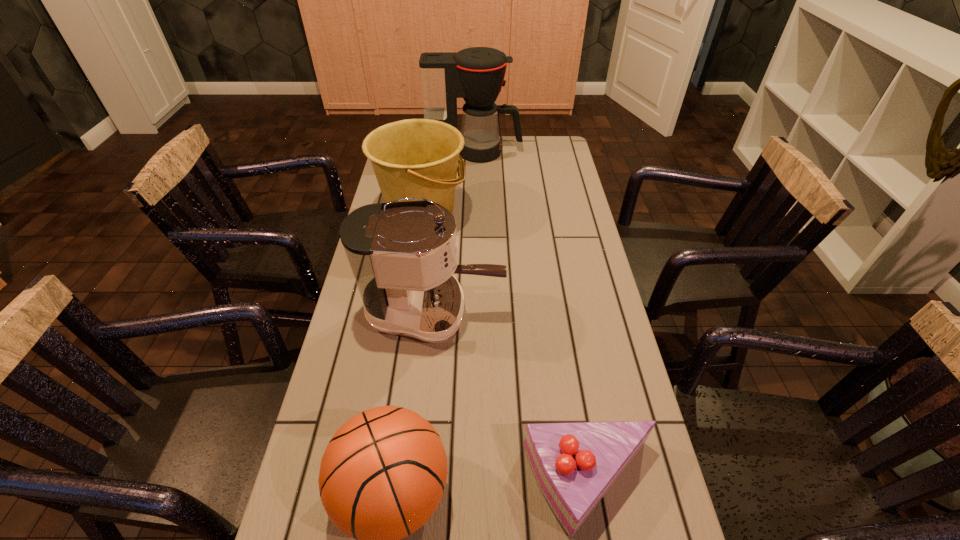
Find the location of a particular element. The height and width of the screenshot is (540, 960). the farthest object is located at coordinates 476,74.

What are the coordinates of `the third farthest object` in the screenshot? It's located at pos(403,255).

I want to click on the second farthest object, so click(x=414, y=158).

Identify the location of the third tallest object. (414, 158).

You are a GUI agent. You are given a task and a screenshot of the screen. Output one action in this format:
    pyautogui.click(x=<x>, y=<y>)
    Task: Click on the cake
    This screenshot has height=540, width=960.
    Given the screenshot: What is the action you would take?
    pyautogui.click(x=575, y=464)

What are the coordinates of `vacant space located pour from the carafe of the farther coffee maker` in the screenshot? It's located at (537, 152).

Find the location of a particular element. vacant space located 0.230m on the front-facing side of the nearer coffee maker is located at coordinates [587, 312].

You are a GUI agent. You are given a task and a screenshot of the screen. Output one action in this format:
    pyautogui.click(x=<x>, y=<y>)
    Task: Click on the free spot located 0.330m on the side of the fourth nearest object with the handle
    The width and height of the screenshot is (960, 540).
    Given the screenshot: What is the action you would take?
    pyautogui.click(x=561, y=213)

Locate an element on the screen. This screenshot has height=540, width=960. vacant space located on the left of the cake is located at coordinates (365, 486).

This screenshot has width=960, height=540. In order to click on object located at the far edge in this screenshot , I will do pos(476,74).